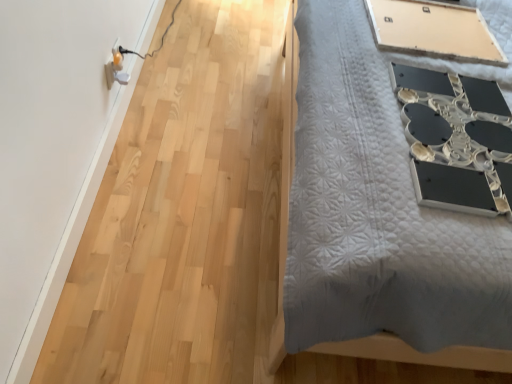
Question: Can we say matte beige board at upper right lies outside white plastic electric outlet at upper left?

Choices:
 (A) yes
 (B) no

Answer: (A)

Question: From a real-world perspective, is matte beige board at upper right physically below white plastic electric outlet at upper left?

Choices:
 (A) no
 (B) yes

Answer: (A)

Question: From the image's perspective, is matte beige board at upper right above white plastic electric outlet at upper left?

Choices:
 (A) yes
 (B) no

Answer: (A)

Question: From the image's perspective, would you say matte beige board at upper right is shown under white plastic electric outlet at upper left?

Choices:
 (A) no
 (B) yes

Answer: (A)

Question: Would you say white plastic electric outlet at upper left is part of matte beige board at upper right's contents?

Choices:
 (A) no
 (B) yes

Answer: (A)

Question: Is matte beige board at upper right in contact with white plastic electric outlet at upper left?

Choices:
 (A) yes
 (B) no

Answer: (B)

Question: Could you tell me if white plastic electric outlet at upper left is facing matte beige board at upper right?

Choices:
 (A) no
 (B) yes

Answer: (B)

Question: Can you confirm if white plastic electric outlet at upper left is smaller than matte beige board at upper right?

Choices:
 (A) yes
 (B) no

Answer: (A)

Question: From the image's perspective, is white plastic electric outlet at upper left beneath matte beige board at upper right?

Choices:
 (A) yes
 (B) no

Answer: (A)

Question: Considering the relative sizes of white plastic electric outlet at upper left and matte beige board at upper right in the image provided, is white plastic electric outlet at upper left bigger than matte beige board at upper right?

Choices:
 (A) yes
 (B) no

Answer: (B)

Question: Can you confirm if white plastic electric outlet at upper left is wider than matte beige board at upper right?

Choices:
 (A) yes
 (B) no

Answer: (B)

Question: Is white plastic electric outlet at upper left closer to the viewer compared to matte beige board at upper right?

Choices:
 (A) yes
 (B) no

Answer: (B)

Question: Visually, is white plastic electric outlet at upper left positioned to the left or to the right of matte beige board at upper right?

Choices:
 (A) left
 (B) right

Answer: (A)